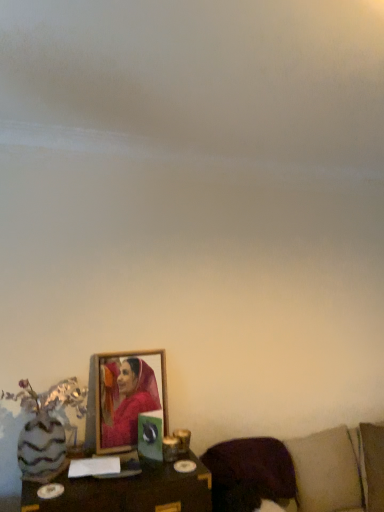
Question: From a real-world perspective, is brown fabric couch at lower right located higher than wooden frame at center?

Choices:
 (A) no
 (B) yes

Answer: (A)

Question: Is brown fabric couch at lower right closer to camera compared to wooden frame at center?

Choices:
 (A) no
 (B) yes

Answer: (B)

Question: From a real-world perspective, is brown fabric couch at lower right under wooden frame at center?

Choices:
 (A) yes
 (B) no

Answer: (A)

Question: Is brown fabric couch at lower right oriented towards wooden frame at center?

Choices:
 (A) yes
 (B) no

Answer: (B)

Question: From the image's perspective, is brown fabric couch at lower right located above wooden frame at center?

Choices:
 (A) no
 (B) yes

Answer: (A)

Question: Is brown fabric couch at lower right to the right of wooden frame at center from the viewer's perspective?

Choices:
 (A) yes
 (B) no

Answer: (A)

Question: Would you say brown fabric couch at lower right is outside purple fabric pillow at lower right?

Choices:
 (A) yes
 (B) no

Answer: (A)

Question: Can you confirm if brown fabric couch at lower right is thinner than purple fabric pillow at lower right?

Choices:
 (A) yes
 (B) no

Answer: (B)

Question: Would you consider brown fabric couch at lower right to be distant from purple fabric pillow at lower right?

Choices:
 (A) yes
 (B) no

Answer: (B)

Question: Considering the relative sizes of brown fabric couch at lower right and purple fabric pillow at lower right in the image provided, is brown fabric couch at lower right bigger than purple fabric pillow at lower right?

Choices:
 (A) yes
 (B) no

Answer: (A)

Question: Is brown fabric couch at lower right facing away from purple fabric pillow at lower right?

Choices:
 (A) yes
 (B) no

Answer: (A)

Question: Is brown fabric couch at lower right smaller than purple fabric pillow at lower right?

Choices:
 (A) no
 (B) yes

Answer: (A)

Question: Is brown fabric couch at lower right surrounded by wooden table at lower center?

Choices:
 (A) yes
 (B) no

Answer: (B)